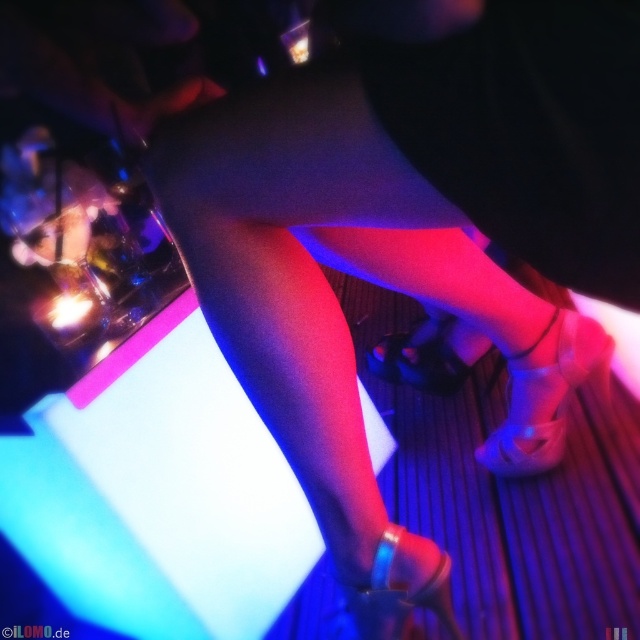
Can you confirm if clear plastic ring at lower center is wider than satin black shoe at center?

Incorrect, clear plastic ring at lower center's width does not surpass satin black shoe at center's.

Is clear plastic ring at lower center to the right of satin black shoe at center from the viewer's perspective?

Incorrect, clear plastic ring at lower center is not on the right side of satin black shoe at center.

Which is in front, point (413, 561) or point (413, 380)?

Positioned in front is point (413, 561).

Where is `clear plastic ring at lower center`? The width and height of the screenshot is (640, 640). clear plastic ring at lower center is located at coordinates (401, 589).

In the scene shown: Can you confirm if clear plastic shoe at lower right is thinner than satin black shoe at center?

Indeed, clear plastic shoe at lower right has a lesser width compared to satin black shoe at center.

The image size is (640, 640). I want to click on clear plastic shoe at lower right, so click(545, 397).

The width and height of the screenshot is (640, 640). What do you see at coordinates (545, 397) in the screenshot? I see `clear plastic shoe at lower right` at bounding box center [545, 397].

Locate an element on the screen. Image resolution: width=640 pixels, height=640 pixels. clear plastic shoe at lower right is located at coordinates (545, 397).

How much distance is there between clear plastic shoe at lower right and clear plastic ring at lower center?

The distance of clear plastic shoe at lower right from clear plastic ring at lower center is 14.36 inches.

Where is `clear plastic shoe at lower right`? The height and width of the screenshot is (640, 640). clear plastic shoe at lower right is located at coordinates (545, 397).